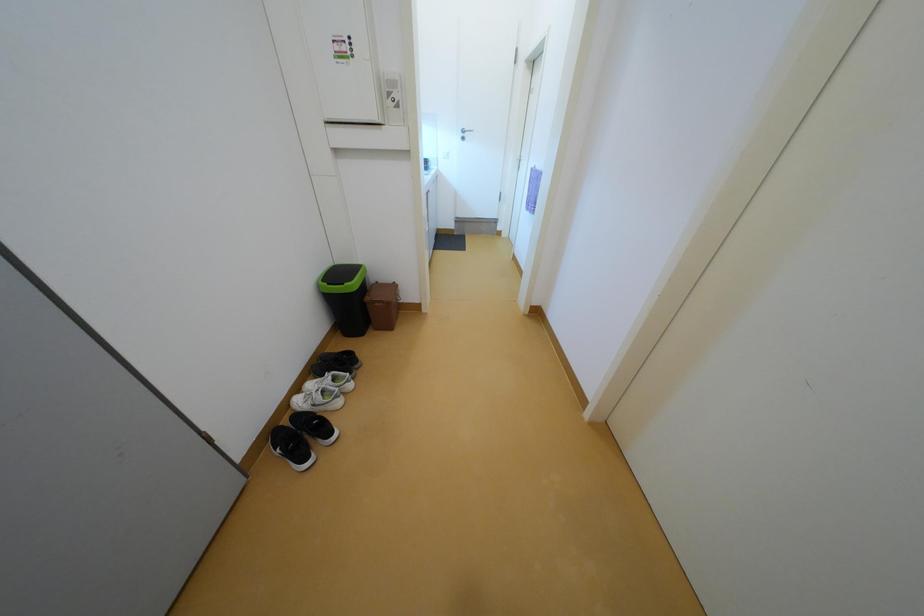
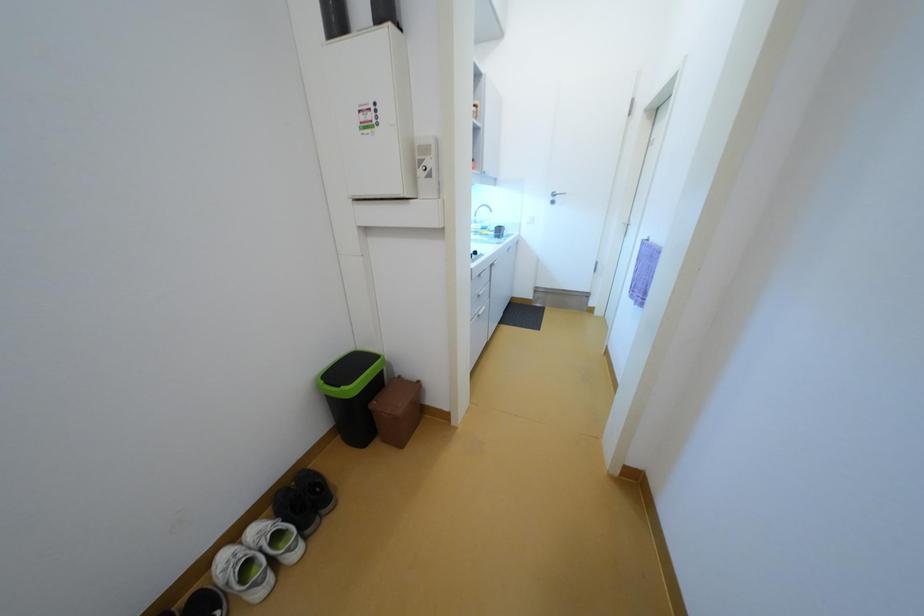
Question: What movement of the cameraman would produce the second image?

Choices:
 (A) Left
 (B) Right
 (C) Forward
 (D) Backward

Answer: (C)